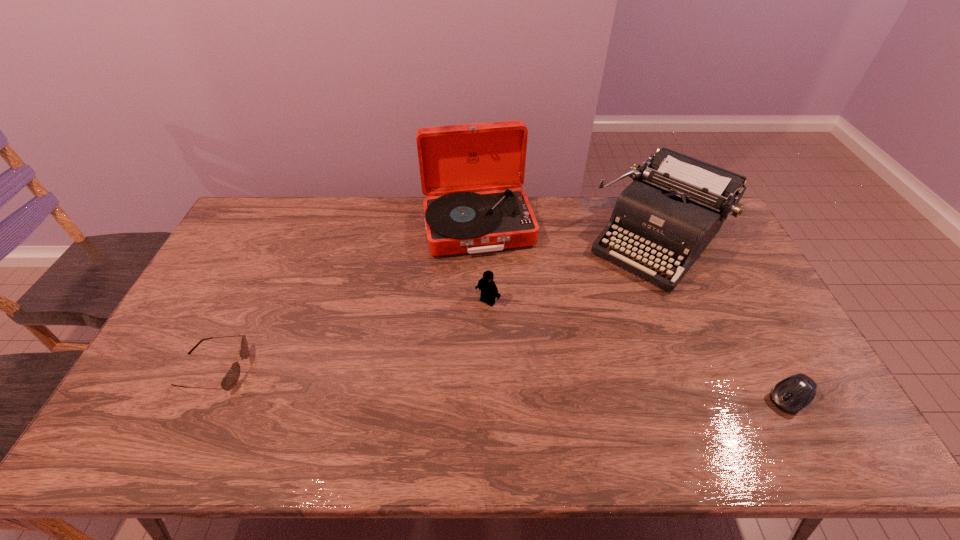
Identify the location of free space between the mouse and the typewriter. Image resolution: width=960 pixels, height=540 pixels. (724, 319).

Identify the location of the fourth closest object to the mouse. This screenshot has height=540, width=960. (231, 378).

You are a GUI agent. You are given a task and a screenshot of the screen. Output one action in this format:
    pyautogui.click(x=<x>, y=<y>)
    Task: Click on the third closest object relative to the mouse
    This screenshot has height=540, width=960.
    Given the screenshot: What is the action you would take?
    pyautogui.click(x=489, y=291)

Locate an element on the screen. This screenshot has height=540, width=960. vacant space that satisfies the following two spatial constraints: 1. on the front side of the tallest object; 2. on the right side of the mouse is located at coordinates (477, 397).